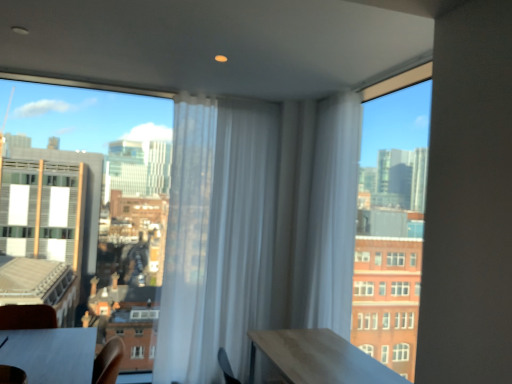
This screenshot has width=512, height=384. What do you see at coordinates (51, 354) in the screenshot?
I see `smooth wooden table at lower left` at bounding box center [51, 354].

At what (x,y) coordinates should I click in order to perform the action: click on white sheer curtain at center, acting as the second curtain starting from the left. Please return your answer as a coordinate pair (x, y). The width and height of the screenshot is (512, 384). Looking at the image, I should click on (332, 215).

Describe the element at coordinates (391, 218) in the screenshot. I see `transparent glass window at upper right, placed as the 1th window when sorted from right to left` at that location.

What do you see at coordinates (217, 236) in the screenshot? I see `white sheer curtain at center, acting as the 2th curtain starting from the right` at bounding box center [217, 236].

Measure the distance between white sheer curtain at center, acting as the 2th curtain starting from the right, and camera.

The depth of white sheer curtain at center, acting as the 2th curtain starting from the right, is 3.47 meters.

The image size is (512, 384). Identify the location of smooth wooden table at lower left. (51, 354).

Is smooth wooden table at lower left further to the viewer compared to transparent glass window at upper right, placed as the 1th window when sorted from right to left?

No, it is in front of transparent glass window at upper right, placed as the 1th window when sorted from right to left.

Is transparent glass window at upper right, placed as the 1th window when sorted from right to left, surrounded by smooth wooden table at lower left?

No, transparent glass window at upper right, placed as the 1th window when sorted from right to left, is not a part of smooth wooden table at lower left.

Considering the sizes of smooth wooden table at lower left and transparent glass window at upper right, placed as the 1th window when sorted from right to left, in the image, is smooth wooden table at lower left wider or thinner than transparent glass window at upper right, placed as the 1th window when sorted from right to left,?

smooth wooden table at lower left is wider than transparent glass window at upper right, placed as the 1th window when sorted from right to left.

Which of these two, smooth wooden table at lower left or transparent glass window at upper right, which is the 2th window in left-to-right order, stands shorter?

Standing shorter between the two is smooth wooden table at lower left.

Consider the image. Would you say transparent glass window at upper left, placed as the second window when sorted from right to left, contains smooth wooden table at lower left?

No, smooth wooden table at lower left is not inside transparent glass window at upper left, placed as the second window when sorted from right to left.

Considering the sizes of objects transparent glass window at upper left, placed as the second window when sorted from right to left, and smooth wooden table at lower left in the image provided, who is taller, transparent glass window at upper left, placed as the second window when sorted from right to left, or smooth wooden table at lower left?

With more height is transparent glass window at upper left, placed as the second window when sorted from right to left.

From the image's perspective, is transparent glass window at upper left, the 1th window viewed from the left, beneath smooth wooden table at lower left?

No, from the image's perspective, transparent glass window at upper left, the 1th window viewed from the left, is not beneath smooth wooden table at lower left.

Does point (113, 249) appear closer or farther from the camera than point (42, 372)?

Point (113, 249).

Is transparent glass window at upper right, placed as the 1th window when sorted from right to left, positioned far away from white sheer curtain at center, acting as the second curtain starting from the left?

transparent glass window at upper right, placed as the 1th window when sorted from right to left, is actually quite close to white sheer curtain at center, acting as the second curtain starting from the left.

Is point (400, 160) farther from camera compared to point (327, 287)?

Yes.

Is transparent glass window at upper right, placed as the 1th window when sorted from right to left, further to the viewer compared to white sheer curtain at center, the 1th curtain when ordered from right to left?

No, transparent glass window at upper right, placed as the 1th window when sorted from right to left, is closer to the camera.

Considering the positions of objects white sheer curtain at center, the first curtain positioned from the left, and white sheer curtain at center, acting as the second curtain starting from the left, in the image provided, who is more to the right, white sheer curtain at center, the first curtain positioned from the left, or white sheer curtain at center, acting as the second curtain starting from the left,?

Positioned to the right is white sheer curtain at center, acting as the second curtain starting from the left.

Can you tell me how much white sheer curtain at center, acting as the 2th curtain starting from the right, and white sheer curtain at center, the 1th curtain when ordered from right to left, differ in facing direction?

The angular difference between white sheer curtain at center, acting as the 2th curtain starting from the right, and white sheer curtain at center, the 1th curtain when ordered from right to left, is 84.7 degrees.

Are white sheer curtain at center, the first curtain positioned from the left, and white sheer curtain at center, acting as the second curtain starting from the left, making contact?

white sheer curtain at center, the first curtain positioned from the left, and white sheer curtain at center, acting as the second curtain starting from the left, are clearly separated.

Is white sheer curtain at center, acting as the 2th curtain starting from the right, situated inside white sheer curtain at center, the 1th curtain when ordered from right to left, or outside?

white sheer curtain at center, acting as the 2th curtain starting from the right, lies outside white sheer curtain at center, the 1th curtain when ordered from right to left.

From a real-world perspective, is transparent glass window at upper right, placed as the 1th window when sorted from right to left, positioned above or below smooth wooden table at lower left?

transparent glass window at upper right, placed as the 1th window when sorted from right to left, is situated higher than smooth wooden table at lower left in the real world.

The image size is (512, 384). Identify the location of table below the transparent glass window at upper right, which is the 2th window in left-to-right order (from a real-world perspective). (51, 354).

Between transparent glass window at upper right, placed as the 1th window when sorted from right to left, and smooth wooden table at lower left, which one has more height?

With more height is transparent glass window at upper right, placed as the 1th window when sorted from right to left.

From the image's perspective, between transparent glass window at upper right, which is the 2th window in left-to-right order, and smooth wooden table at lower left, which one is located above?

transparent glass window at upper right, which is the 2th window in left-to-right order.

Can you tell me how much transparent glass window at upper left, placed as the second window when sorted from right to left, and white sheer curtain at center, the 1th curtain when ordered from right to left, differ in facing direction?

The facing directions of transparent glass window at upper left, placed as the second window when sorted from right to left, and white sheer curtain at center, the 1th curtain when ordered from right to left, are 90.5 degrees apart.

The height and width of the screenshot is (384, 512). Identify the location of the 2nd window below the white sheer curtain at center, acting as the second curtain starting from the left (from the image's perspective). (88, 182).

How distant is transparent glass window at upper left, the 1th window viewed from the left, from white sheer curtain at center, acting as the second curtain starting from the left?

transparent glass window at upper left, the 1th window viewed from the left, and white sheer curtain at center, acting as the second curtain starting from the left, are 3.58 meters apart.

Is point (148, 207) less distant than point (327, 174)?

No, (148, 207) is behind (327, 174).

Would you say transparent glass window at upper right, placed as the 1th window when sorted from right to left, is part of transparent glass window at upper left, the 1th window viewed from the left,'s contents?

No, transparent glass window at upper left, the 1th window viewed from the left, does not contain transparent glass window at upper right, placed as the 1th window when sorted from right to left.

Considering the relative sizes of transparent glass window at upper left, the 1th window viewed from the left, and transparent glass window at upper right, placed as the 1th window when sorted from right to left, in the image provided, is transparent glass window at upper left, the 1th window viewed from the left, thinner than transparent glass window at upper right, placed as the 1th window when sorted from right to left,?

Correct, the width of transparent glass window at upper left, the 1th window viewed from the left, is less than that of transparent glass window at upper right, placed as the 1th window when sorted from right to left.

Are transparent glass window at upper left, placed as the second window when sorted from right to left, and transparent glass window at upper right, which is the 2th window in left-to-right order, located far from each other?

Indeed, transparent glass window at upper left, placed as the second window when sorted from right to left, is not near transparent glass window at upper right, which is the 2th window in left-to-right order.

Is transparent glass window at upper left, placed as the second window when sorted from right to left, turned away from transparent glass window at upper right, placed as the 1th window when sorted from right to left?

No, transparent glass window at upper left, placed as the second window when sorted from right to left, is not facing the opposite direction of transparent glass window at upper right, placed as the 1th window when sorted from right to left.

From a real-world perspective, which window is the 2nd one above the smooth wooden table at lower left? Please provide its 2D coordinates.

[(391, 218)]

What are the coordinates of `table that is below the transparent glass window at upper left, placed as the second window when sorted from right to left (from the image's perspective)` in the screenshot? It's located at (51, 354).

From the image, which object appears to be nearer to transparent glass window at upper left, placed as the second window when sorted from right to left, white sheer curtain at center, the first curtain positioned from the left, or smooth wooden table at lower left?

Among the two, white sheer curtain at center, the first curtain positioned from the left, is located nearer to transparent glass window at upper left, placed as the second window when sorted from right to left.

From the picture: Estimate the real-world distances between objects in this image. Which object is further from white sheer curtain at center, acting as the 2th curtain starting from the right, smooth wooden table at lower left or transparent glass window at upper left, placed as the second window when sorted from right to left?

The object further to white sheer curtain at center, acting as the 2th curtain starting from the right, is transparent glass window at upper left, placed as the second window when sorted from right to left.

When comparing their distances from smooth wooden table at lower left, does white sheer curtain at center, the first curtain positioned from the left, or white sheer curtain at center, acting as the second curtain starting from the left, seem closer?

white sheer curtain at center, the first curtain positioned from the left, is positioned closer to the anchor smooth wooden table at lower left.

From the image, which object appears to be farther from white sheer curtain at center, acting as the second curtain starting from the left, white sheer curtain at center, acting as the 2th curtain starting from the right, or smooth wooden table at lower left?

smooth wooden table at lower left is positioned further to the anchor white sheer curtain at center, acting as the second curtain starting from the left.

Considering their positions, is transparent glass window at upper left, placed as the second window when sorted from right to left, positioned closer to transparent glass window at upper right, which is the 2th window in left-to-right order, than smooth wooden table at lower left?

Based on the image, smooth wooden table at lower left appears to be nearer to transparent glass window at upper right, which is the 2th window in left-to-right order.

Looking at the image, which one is located closer to transparent glass window at upper right, placed as the 1th window when sorted from right to left, smooth wooden table at lower left or white sheer curtain at center, acting as the 2th curtain starting from the right?

The object closer to transparent glass window at upper right, placed as the 1th window when sorted from right to left, is white sheer curtain at center, acting as the 2th curtain starting from the right.

From the image, which object appears to be farther from white sheer curtain at center, acting as the second curtain starting from the left, transparent glass window at upper right, which is the 2th window in left-to-right order, or smooth wooden table at lower left?

smooth wooden table at lower left lies further to white sheer curtain at center, acting as the second curtain starting from the left, than the other object.

In the scene shown: Based on their spatial positions, is transparent glass window at upper right, which is the 2th window in left-to-right order, or transparent glass window at upper left, the 1th window viewed from the left, closer to white sheer curtain at center, the 1th curtain when ordered from right to left?

The object closer to white sheer curtain at center, the 1th curtain when ordered from right to left, is transparent glass window at upper right, which is the 2th window in left-to-right order.

At what (x,y) coordinates should I click in order to perform the action: click on table situated between transparent glass window at upper left, placed as the second window when sorted from right to left, and white sheer curtain at center, acting as the second curtain starting from the left, from left to right. Please return your answer as a coordinate pair (x, y). Looking at the image, I should click on [51, 354].

You are a GUI agent. You are given a task and a screenshot of the screen. Output one action in this format:
    pyautogui.click(x=<x>, y=<y>)
    Task: Click on the curtain positioned between smooth wooden table at lower left and white sheer curtain at center, acting as the 2th curtain starting from the right, from near to far
    
    Given the screenshot: What is the action you would take?
    pyautogui.click(x=332, y=215)

Image resolution: width=512 pixels, height=384 pixels. I want to click on table between transparent glass window at upper left, the 1th window viewed from the left, and transparent glass window at upper right, which is the 2th window in left-to-right order, so point(51,354).

Where is `curtain situated between white sheer curtain at center, the first curtain positioned from the left, and transparent glass window at upper right, which is the 2th window in left-to-right order, from left to right`? curtain situated between white sheer curtain at center, the first curtain positioned from the left, and transparent glass window at upper right, which is the 2th window in left-to-right order, from left to right is located at coordinates tap(332, 215).